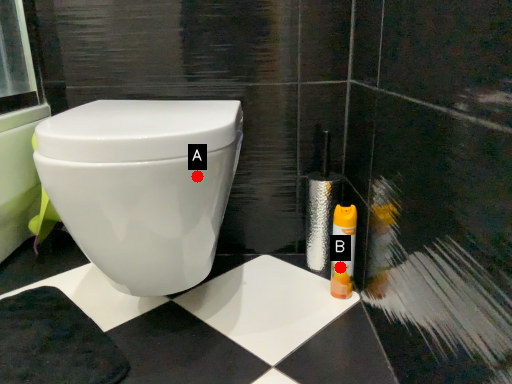
Question: Two points are circled on the image, labeled by A and B beside each circle. Which point is farther to the camera?

Choices:
 (A) A is further
 (B) B is further

Answer: (B)